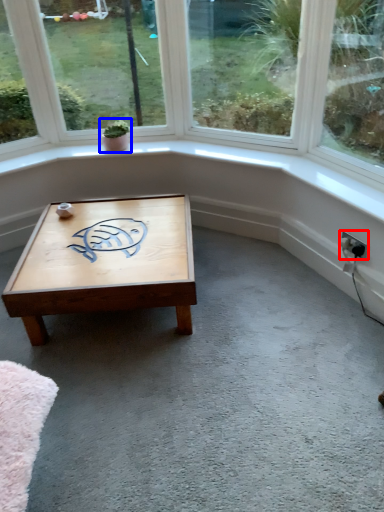
Question: Which of the following is the closest to the observer, electric outlet (highlighted by a red box) or houseplant (highlighted by a blue box)?

Choices:
 (A) electric outlet
 (B) houseplant

Answer: (A)